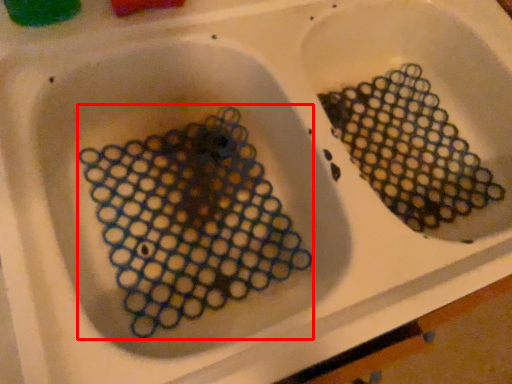
Question: From the image's perspective, considering the relative positions of debris (annotated by the red box) and debris in the image provided, where is debris (annotated by the red box) located with respect to the staircase?

Choices:
 (A) below
 (B) above

Answer: (A)